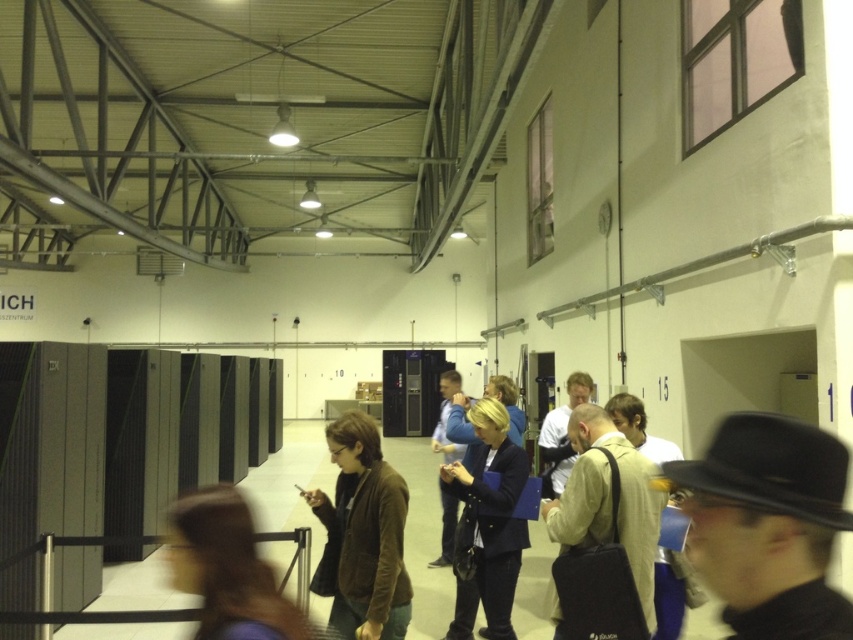
Which is behind, point (560, 531) or point (488, 556)?

Positioned behind is point (488, 556).

Is light beige fabric shirt at center to the right of dark blue blazer at center from the viewer's perspective?

Result: Correct, you'll find light beige fabric shirt at center to the right of dark blue blazer at center.

What do you see at coordinates (608, 499) in the screenshot? The width and height of the screenshot is (853, 640). I see `light beige fabric shirt at center` at bounding box center [608, 499].

In order to click on light beige fabric shirt at center in this screenshot , I will do `click(608, 499)`.

Which is above, light beige fabric shirt at center or blue fabric jacket at center?

light beige fabric shirt at center

Does light beige fabric shirt at center have a greater height compared to blue fabric jacket at center?

In fact, light beige fabric shirt at center may be shorter than blue fabric jacket at center.

I want to click on light beige fabric shirt at center, so click(x=608, y=499).

Is brown leather jacket at center below light beige fabric shirt at center?

Actually, brown leather jacket at center is above light beige fabric shirt at center.

Can you confirm if brown leather jacket at center is bigger than light beige fabric shirt at center?

Incorrect, brown leather jacket at center is not larger than light beige fabric shirt at center.

Locate an element on the screen. The width and height of the screenshot is (853, 640). brown leather jacket at center is located at coordinates (227, 570).

I want to click on brown leather jacket at center, so click(x=227, y=570).